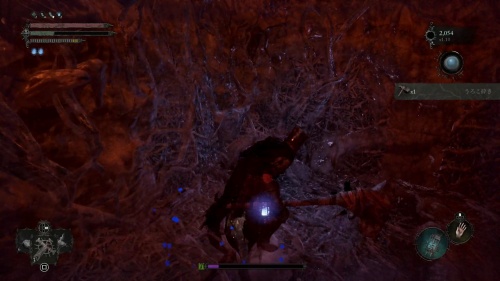
I want to click on light orb, so click(264, 213).